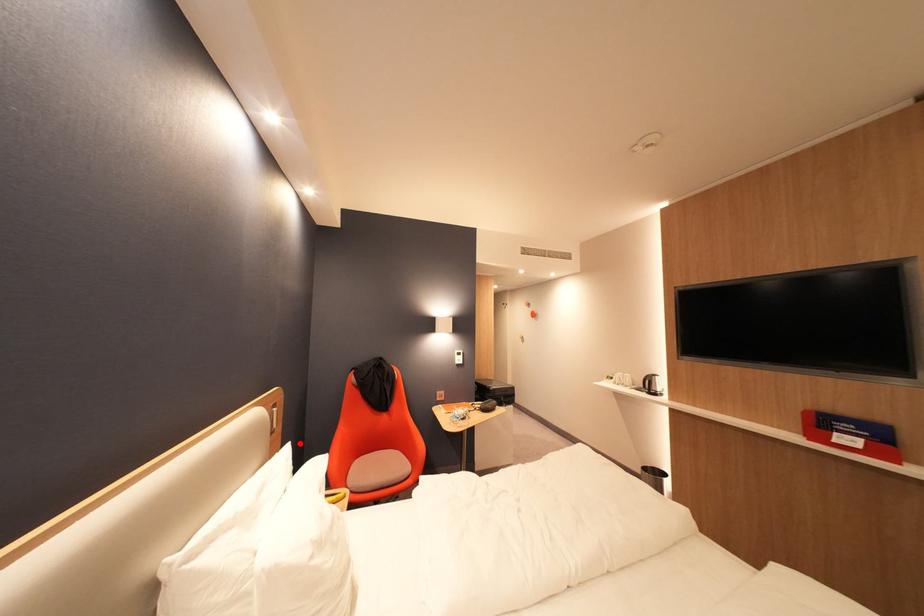
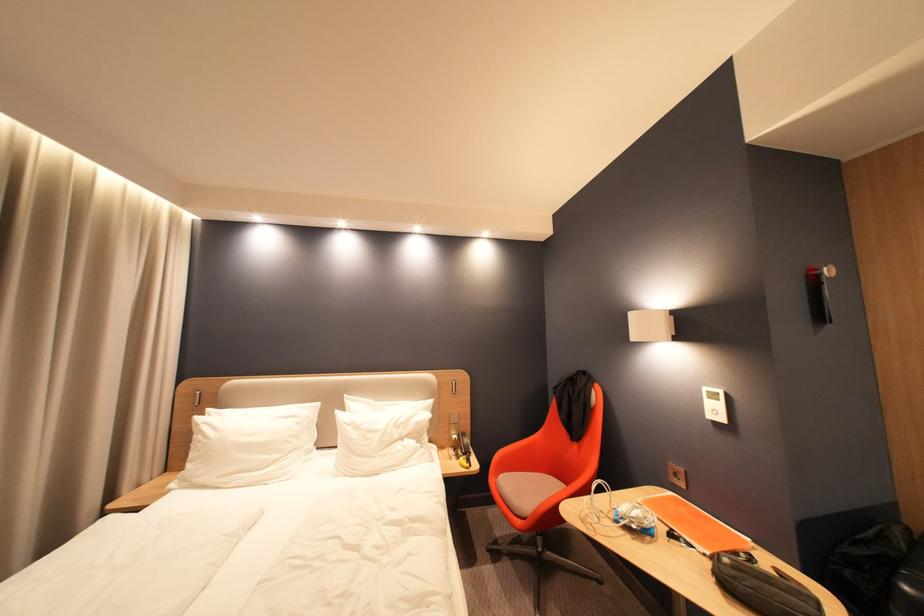
In the second image, find the point that corresponds to the highlighted location in the first image.

(443, 400)